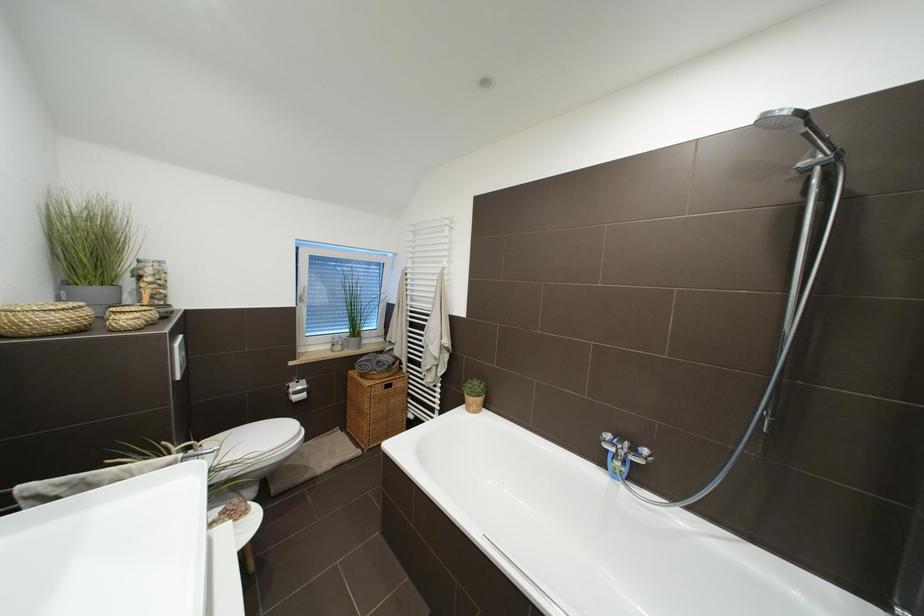
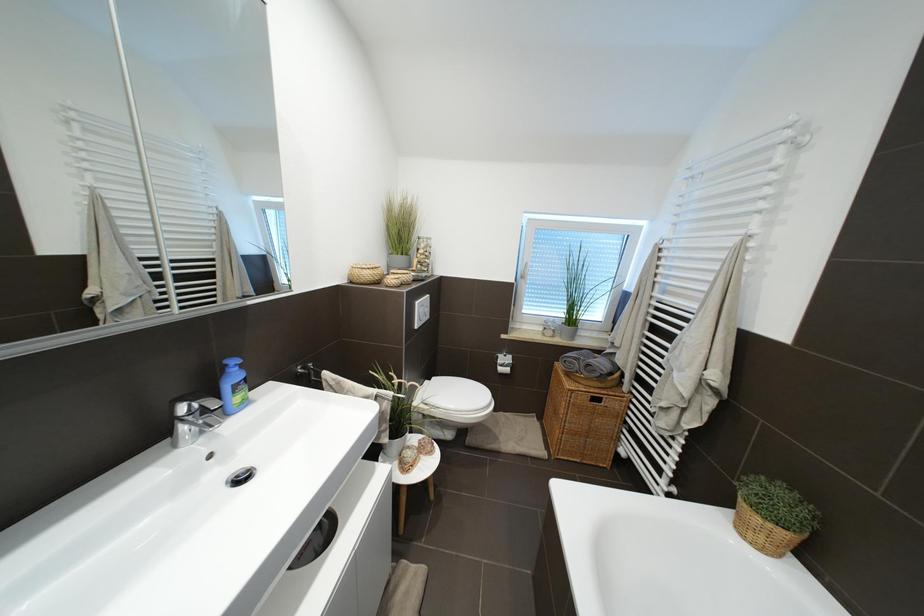
Question: The camera is either moving clockwise (left) or counter-clockwise (right) around the object. The first image is from the beginning of the video and the second image is from the end. Is the camera moving left or right when shooting the video?

Choices:
 (A) Left
 (B) Right

Answer: (B)